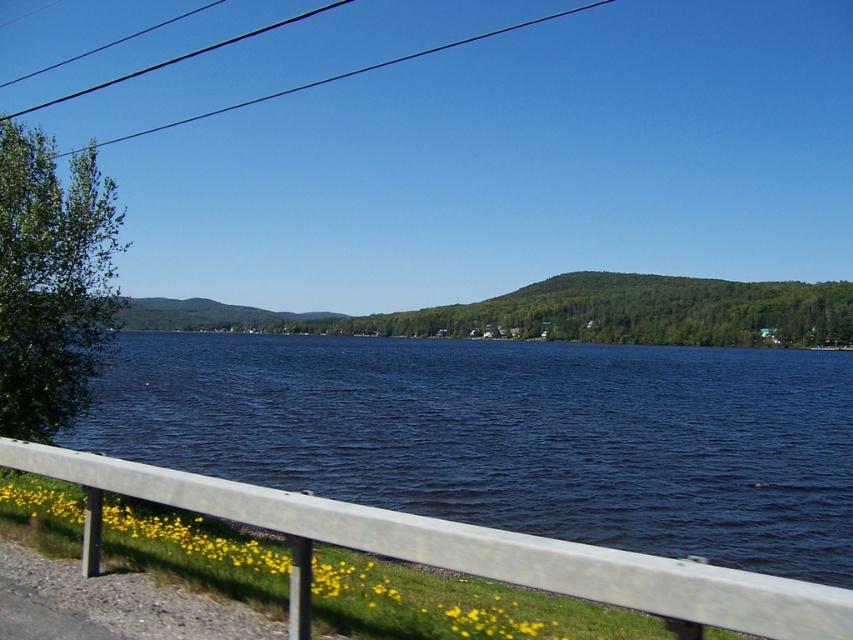
Which of these two, silver metallic rail at lower center or black wire at upper left, stands shorter?

silver metallic rail at lower center is shorter.

Where is `silver metallic rail at lower center`? This screenshot has height=640, width=853. silver metallic rail at lower center is located at coordinates (474, 547).

Is blue water at center thinner than silver metallic rail at lower center?

No.

Is blue water at center to the right of silver metallic rail at lower center from the viewer's perspective?

Indeed, blue water at center is positioned on the right side of silver metallic rail at lower center.

Is point (560, 484) closer to viewer compared to point (254, 493)?

That is False.

Image resolution: width=853 pixels, height=640 pixels. I want to click on blue water at center, so click(x=511, y=435).

Between blue water at center and black wire at upper left, which one is positioned lower?

blue water at center is below.

Between blue water at center and black wire at upper left, which one is positioned higher?

Positioned higher is black wire at upper left.

Who is more forward, (798,392) or (264,99)?

Point (798,392)

Identify the location of blue water at center. The width and height of the screenshot is (853, 640). (511, 435).